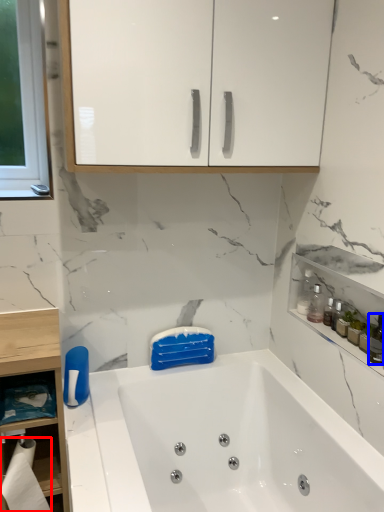
Question: Among these objects, which one is nearest to the camera, toilet paper (highlighted by a red box) or toiletry (highlighted by a blue box)?

Choices:
 (A) toilet paper
 (B) toiletry

Answer: (B)